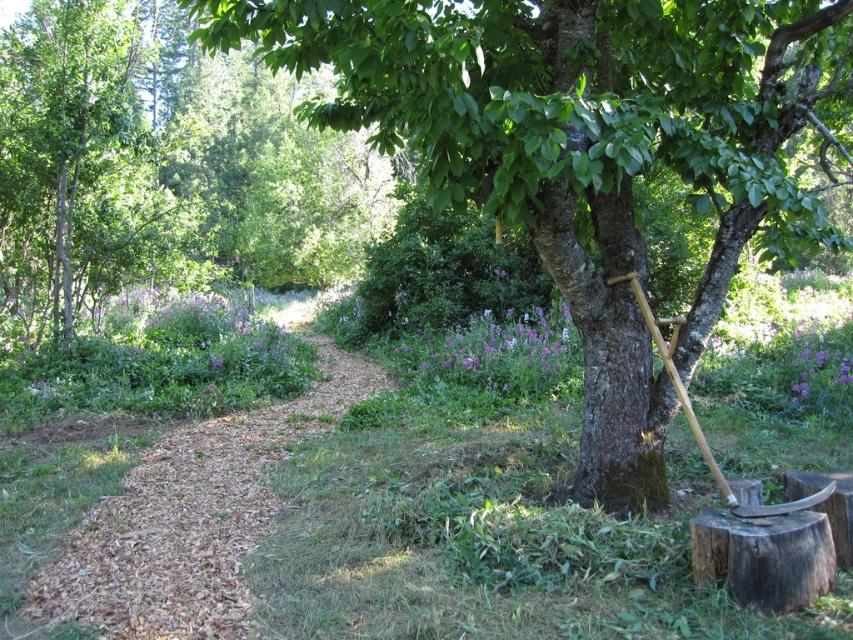
Question: Estimate the real-world distances between objects in this image. Which object is farther from the green rough bark tree at center?

Choices:
 (A) wooden shovel at tree right
 (B) brown mulch trail at center

Answer: (B)

Question: Does green rough bark tree at center come in front of brown mulch trail at center?

Choices:
 (A) yes
 (B) no

Answer: (A)

Question: Which point is closer to the camera taking this photo?

Choices:
 (A) (634, 417)
 (B) (225, 536)
 (C) (724, 492)

Answer: (C)

Question: Does green rough bark tree at center lie behind brown mulch trail at center?

Choices:
 (A) yes
 (B) no

Answer: (B)

Question: Which point is closer to the camera taking this photo?

Choices:
 (A) (782, 6)
 (B) (671, 381)
 (C) (108, 525)

Answer: (B)

Question: Does brown mulch trail at center appear over wooden shovel at tree right?

Choices:
 (A) yes
 (B) no

Answer: (B)